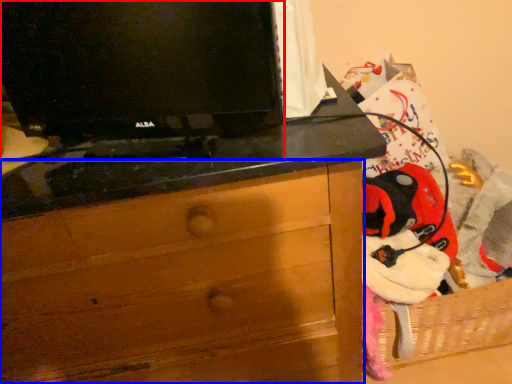
Question: Among these objects, which one is farthest to the camera, television (highlighted by a red box) or chest of drawers (highlighted by a blue box)?

Choices:
 (A) television
 (B) chest of drawers

Answer: (B)